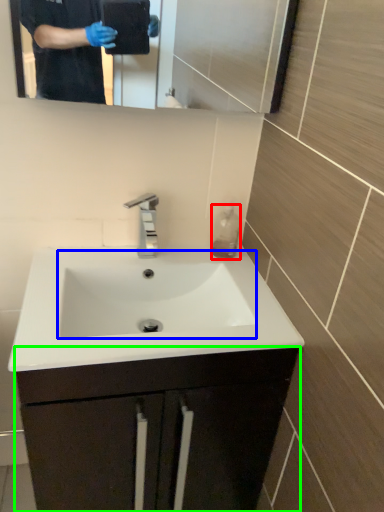
Question: Which is farther away from liquid (highlighted by a red box)? sink (highlighted by a blue box) or bathroom cabinet (highlighted by a green box)?

Choices:
 (A) sink
 (B) bathroom cabinet

Answer: (B)